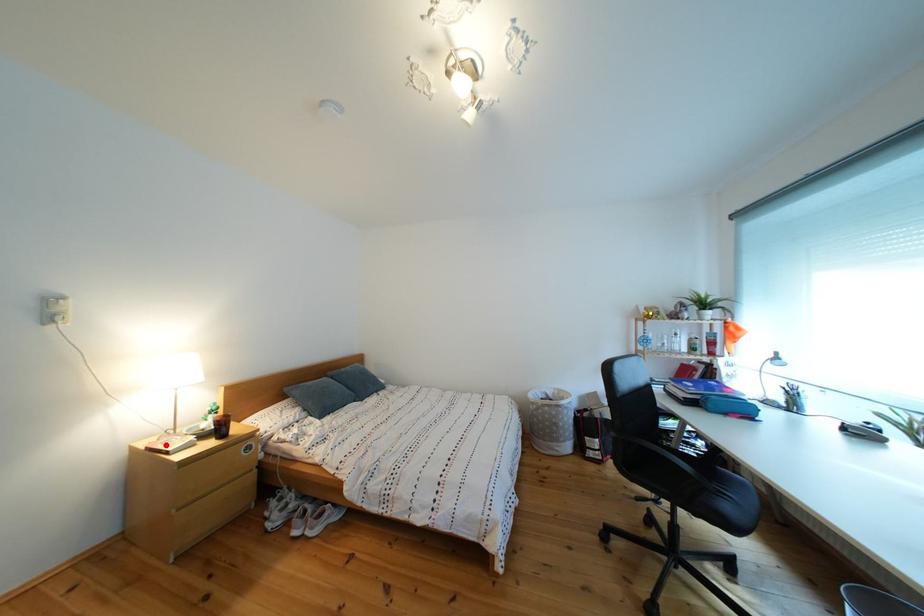
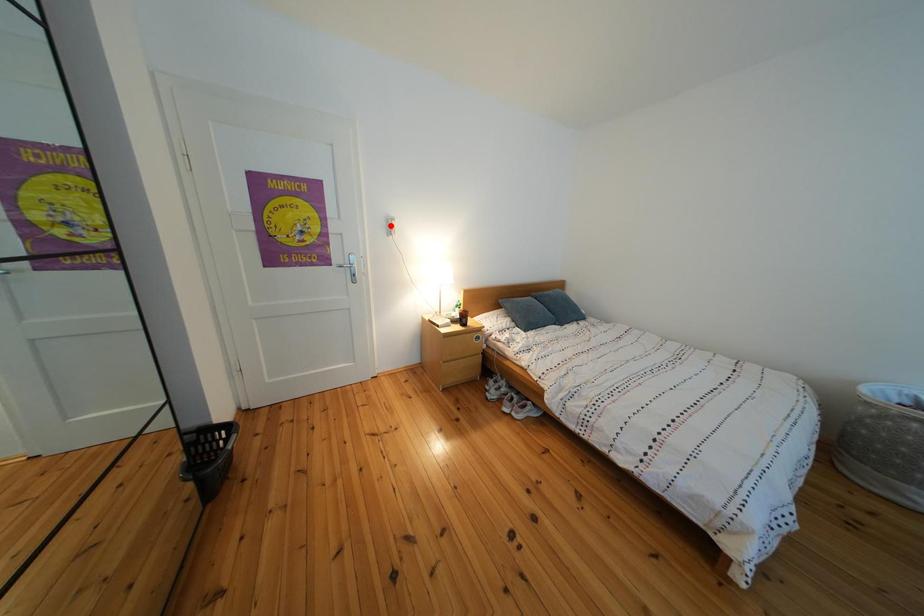
I am providing you with two images of the same scene from different viewpoints. A red point is marked on the first image and another point is marked on the second image. Are the points marked in image1 and image2 representing the same 3D position?

No